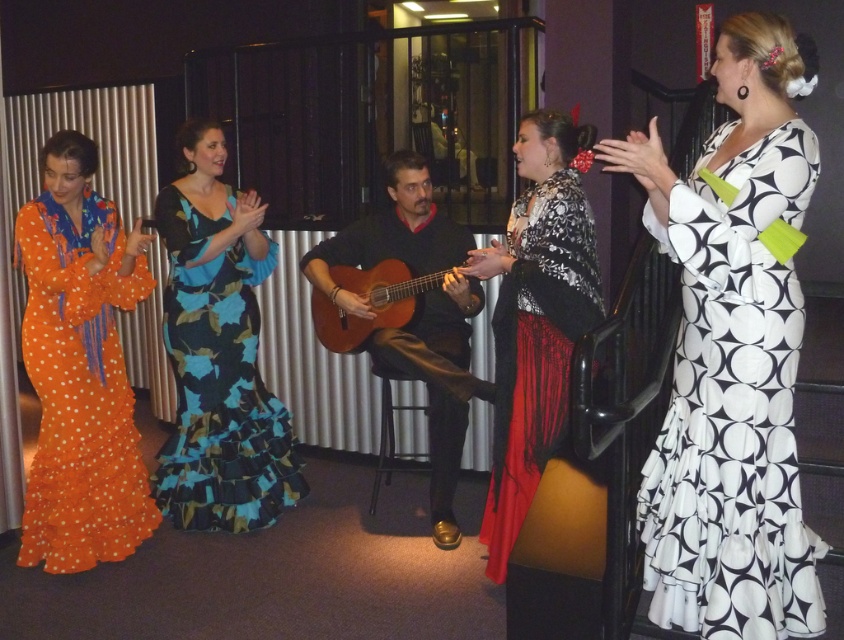
Question: Considering the relative positions of black and white printed dress at right and wooden acoustic guitar at center in the image provided, where is black and white printed dress at right located with respect to wooden acoustic guitar at center?

Choices:
 (A) right
 (B) left

Answer: (A)

Question: Which of the following is the farthest from the observer?

Choices:
 (A) floral print fabric dress at center
 (B) wooden acoustic guitar at center
 (C) orange polka dot fabric dress at left

Answer: (A)

Question: Can you confirm if black and white printed dress at right is positioned above floral print fabric dress at center?

Choices:
 (A) no
 (B) yes

Answer: (B)

Question: Estimate the real-world distances between objects in this image. Which object is closer to the matte black guitar at center?

Choices:
 (A) black and white printed dress at right
 (B) orange polka dot fabric dress at left
 (C) wooden acoustic guitar at center

Answer: (C)

Question: Which point is closer to the camera?

Choices:
 (A) (723, 237)
 (B) (393, 467)

Answer: (A)

Question: Does black and white printed dress at right appear on the right side of black metal stool at center?

Choices:
 (A) yes
 (B) no

Answer: (A)